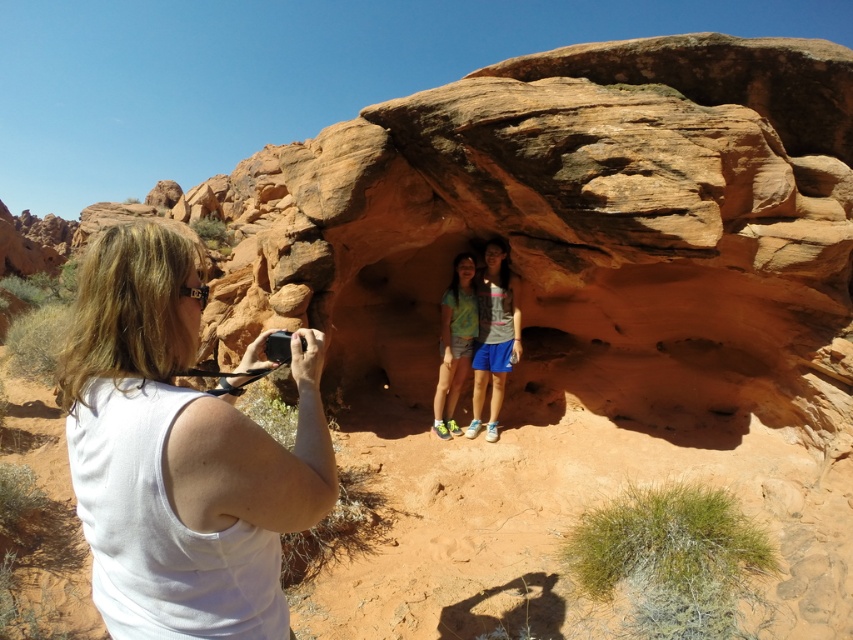
Is white fabric at left above green fabric shirt at center?

No, white fabric at left is not above green fabric shirt at center.

Is white fabric at left to the left of green fabric shirt at center from the viewer's perspective?

Correct, you'll find white fabric at left to the left of green fabric shirt at center.

Who is more distant from viewer, (252,483) or (463,268)?

The point (463,268) is more distant.

You are a GUI agent. You are given a task and a screenshot of the screen. Output one action in this format:
    pyautogui.click(x=<x>, y=<y>)
    Task: Click on the white fabric at left
    The image size is (853, 640).
    Given the screenshot: What is the action you would take?
    pyautogui.click(x=178, y=452)